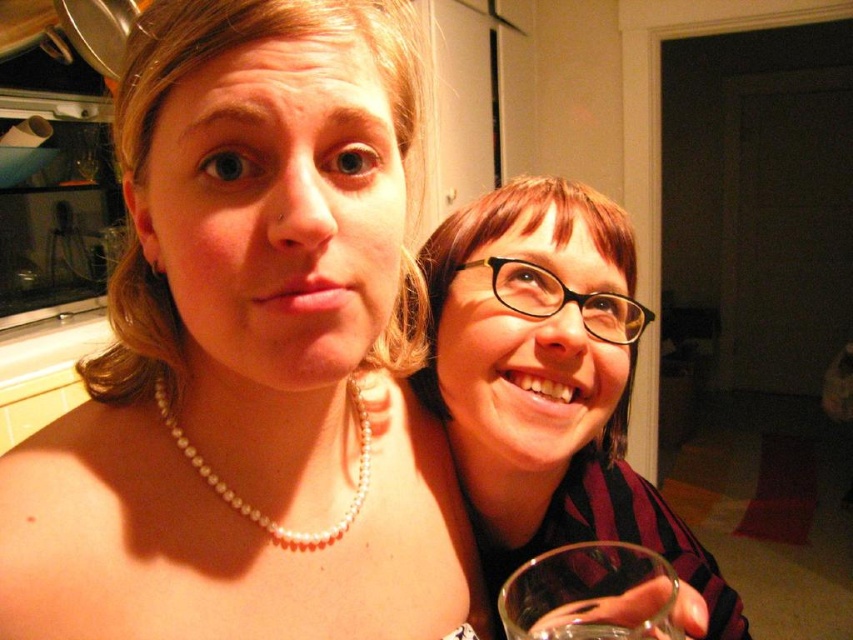
Consider the image. Does black plastic glasses at right have a greater height compared to pearl necklace at center?

Yes, black plastic glasses at right is taller than pearl necklace at center.

Describe the element at coordinates (549, 385) in the screenshot. This screenshot has width=853, height=640. I see `black plastic glasses at right` at that location.

Where is `black plastic glasses at right`? This screenshot has width=853, height=640. black plastic glasses at right is located at coordinates (549, 385).

Measure the distance between pearl necklace at upper left and transparent glass at lower right.

pearl necklace at upper left and transparent glass at lower right are 7.19 inches apart from each other.

Does pearl necklace at upper left have a lesser height compared to transparent glass at lower right?

In fact, pearl necklace at upper left may be taller than transparent glass at lower right.

Between point (376, 442) and point (503, 627), which one is positioned in front?

Point (503, 627)

Locate an element on the screen. This screenshot has height=640, width=853. pearl necklace at upper left is located at coordinates (251, 356).

Is black plastic glasses at right bigger than transparent glass at lower right?

Indeed, black plastic glasses at right has a larger size compared to transparent glass at lower right.

Who is positioned more to the right, black plastic glasses at right or transparent glass at lower right?

From the viewer's perspective, black plastic glasses at right appears more on the right side.

Is point (494, 349) behind point (642, 552)?

Yes, it is.

Where is `black plastic glasses at right`? Image resolution: width=853 pixels, height=640 pixels. black plastic glasses at right is located at coordinates (549, 385).